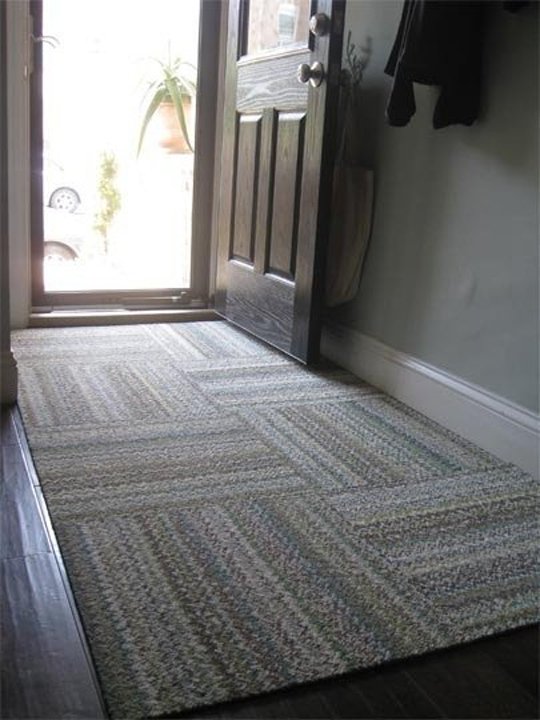
This screenshot has height=720, width=540. Identify the location of empty wall below garment. (468, 294).